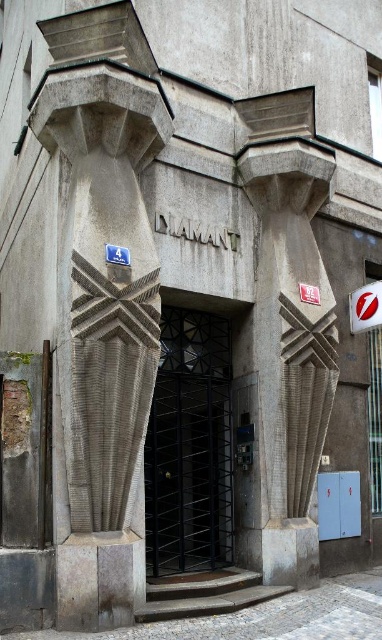
You are standing at the entrance of the building and want to touch both the gray stone column at center and the white plastic sign at upper right. Which object will require you to move forward more to reach?

The white plastic sign at upper right will require moving forward more because it is further away from the viewer compared to the gray stone column at center.

You are a delivery person trying to enter the building through the black metal gate at center. The gray textured column at left is blocking your path. Can you pass through the gap between the column and the gate?

The gray textured column at left has a lesser width compared to black metal gate at center. Since the column is narrower than the gate, there is sufficient space between them to pass through the gap.